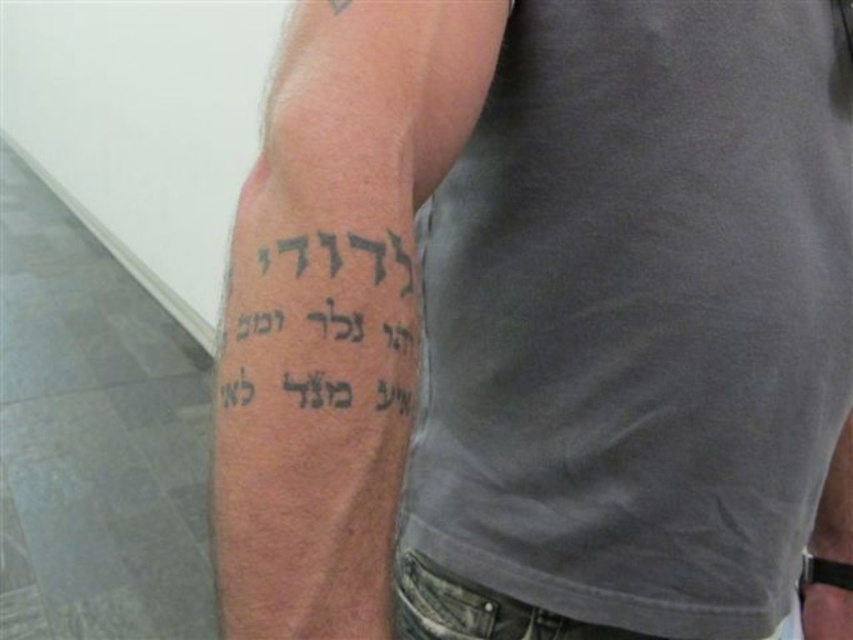
Between point (292, 323) and point (413, 368), which one is positioned in front?

Point (292, 323)

The height and width of the screenshot is (640, 853). I want to click on black ink tattoo at upper left, so click(x=334, y=308).

Where is `black ink tattoo at upper left`? black ink tattoo at upper left is located at coordinates (334, 308).

Is black ink tattoo at upper left smaller than black ink tattoo at lower left?

Actually, black ink tattoo at upper left might be larger than black ink tattoo at lower left.

Does black ink tattoo at upper left have a lesser height compared to black ink tattoo at lower left?

Incorrect, black ink tattoo at upper left's height does not fall short of black ink tattoo at lower left's.

Does point (271, 524) come in front of point (839, 458)?

Yes.

Identify the location of black ink tattoo at upper left. The height and width of the screenshot is (640, 853). (334, 308).

From the picture: Does black ink text at upper arm have a larger size compared to black ink tattoo at lower left?

No.

Between black ink text at upper arm and black ink tattoo at lower left, which one appears on the right side from the viewer's perspective?

From the viewer's perspective, black ink tattoo at lower left appears more on the right side.

What do you see at coordinates (320, 323) in the screenshot? I see `black ink text at upper arm` at bounding box center [320, 323].

Find the location of a particular element. black ink text at upper arm is located at coordinates (320, 323).